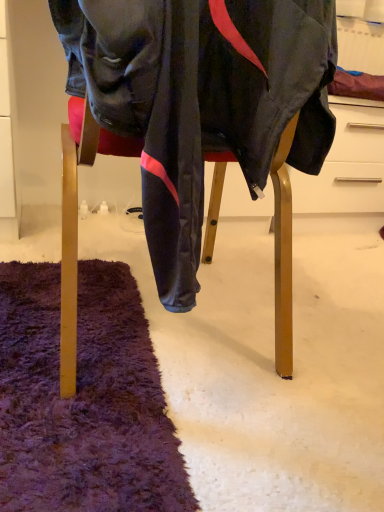
Question: Should I look upward or downward to see velvet black pants at lower center?

Choices:
 (A) up
 (B) down

Answer: (A)